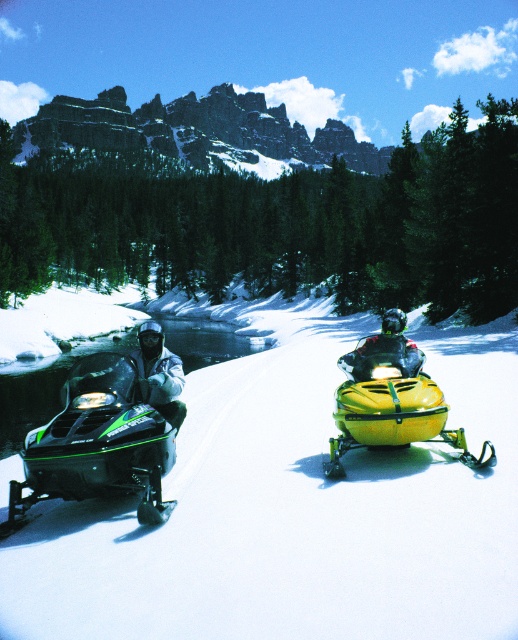
You are planning to take a photo of the green plastic snowmobile at center and the white matte jacket at left. Which object should you focus on first if you want to capture both in the same frame without moving the camera?

You should focus on the green plastic snowmobile at center first since it is larger than the white matte jacket at left, ensuring it fills the frame appropriately while still capturing the smaller jacket in the shot.